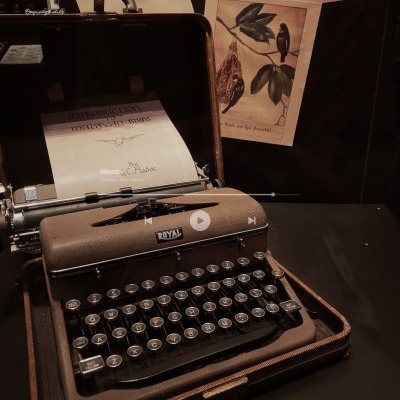
Where is `royal button on the typewriter`? The width and height of the screenshot is (400, 400). royal button on the typewriter is located at coordinates (172, 234).